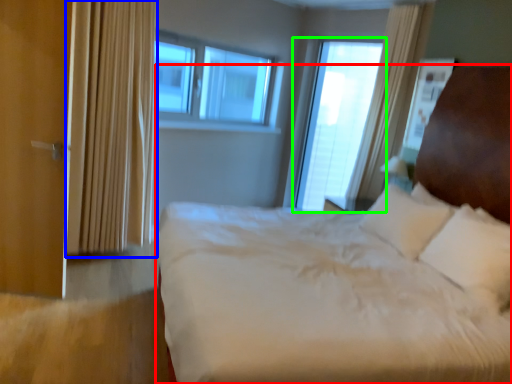
Question: Estimate the real-world distances between objects in this image. Which object is farther from bed (highlighted by a red box), curtain (highlighted by a blue box) or window (highlighted by a green box)?

Choices:
 (A) curtain
 (B) window

Answer: (B)